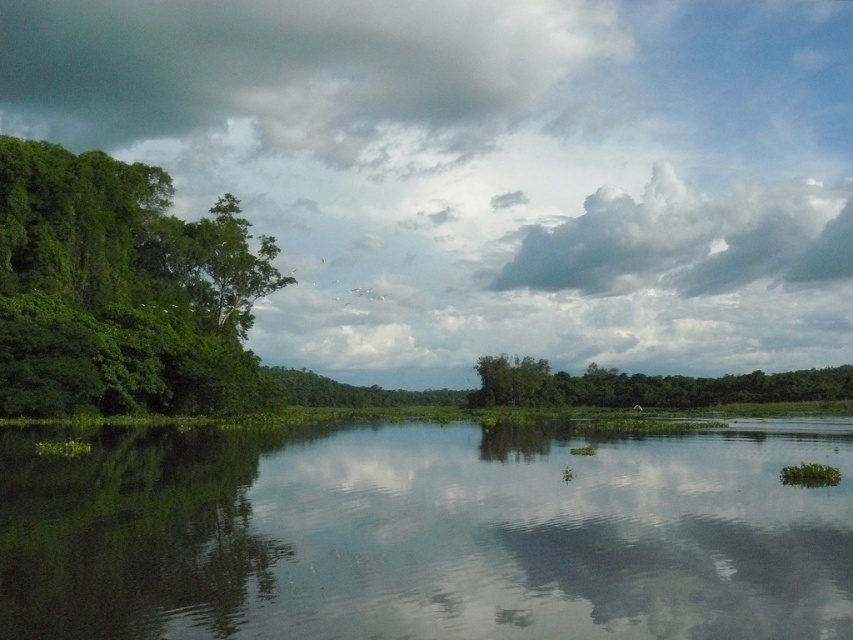
Question: Can you confirm if green leafy tree at left is wider than white fluffy cloud at upper center?

Choices:
 (A) no
 (B) yes

Answer: (A)

Question: Does green leafy tree at left appear under green leafy tree at center?

Choices:
 (A) no
 (B) yes

Answer: (A)

Question: Can you confirm if white fluffy cloud at upper center is positioned below green leafy tree at center?

Choices:
 (A) no
 (B) yes

Answer: (A)

Question: Among these points, which one is farthest from the camera?

Choices:
 (A) (619, 400)
 (B) (157, 353)
 (C) (166, 131)
 (D) (445, 586)

Answer: (C)

Question: Which point is farther from the camera taking this photo?

Choices:
 (A) (532, 368)
 (B) (257, 509)
 (C) (119, 372)
 (D) (503, 35)

Answer: (D)

Question: Among these objects, which one is farthest from the camera?

Choices:
 (A) dark gray cloud at upper left
 (B) white fluffy cloud at upper center
 (C) green reflective water at center

Answer: (A)